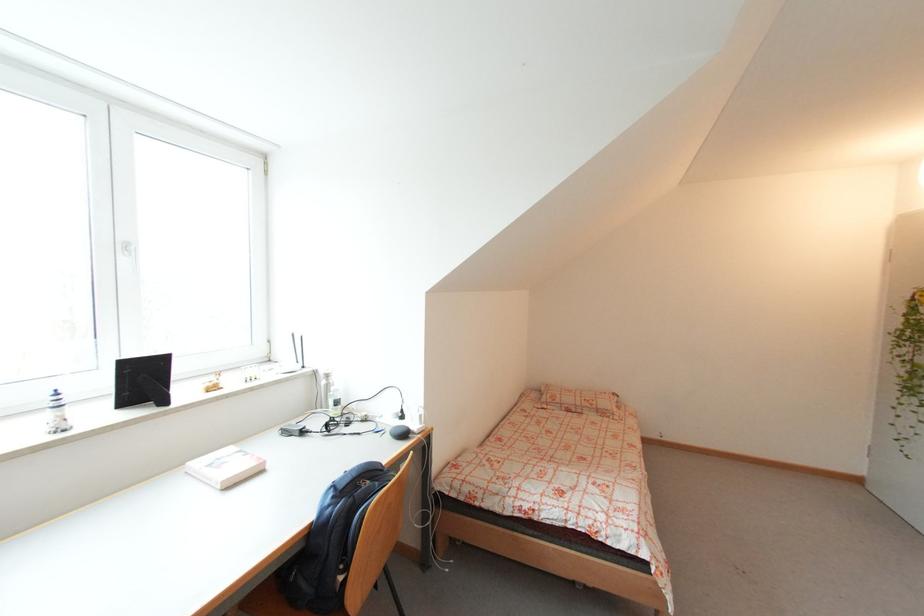
Describe the element at coordinates (56, 413) in the screenshot. The width and height of the screenshot is (924, 616). I see `a small lighthouse figurine` at that location.